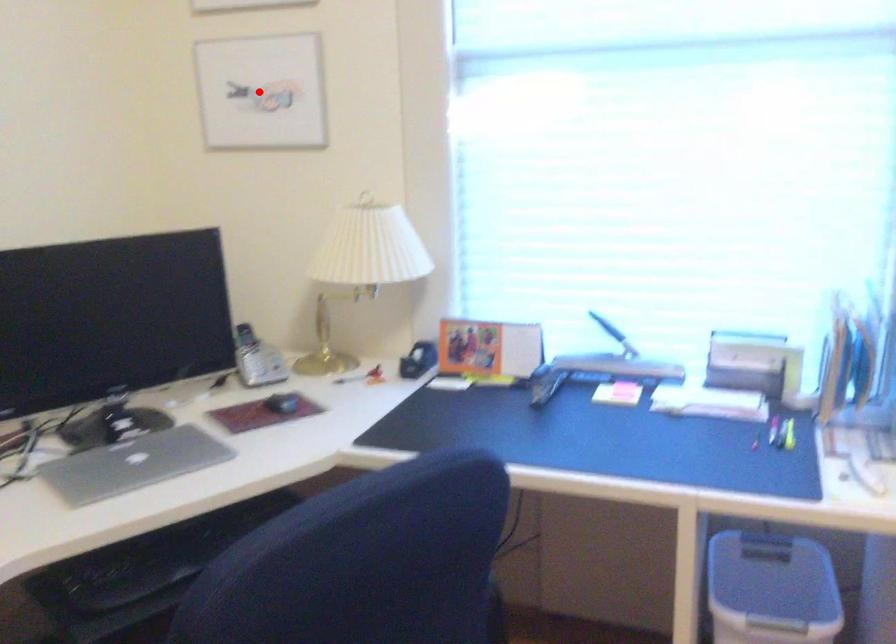
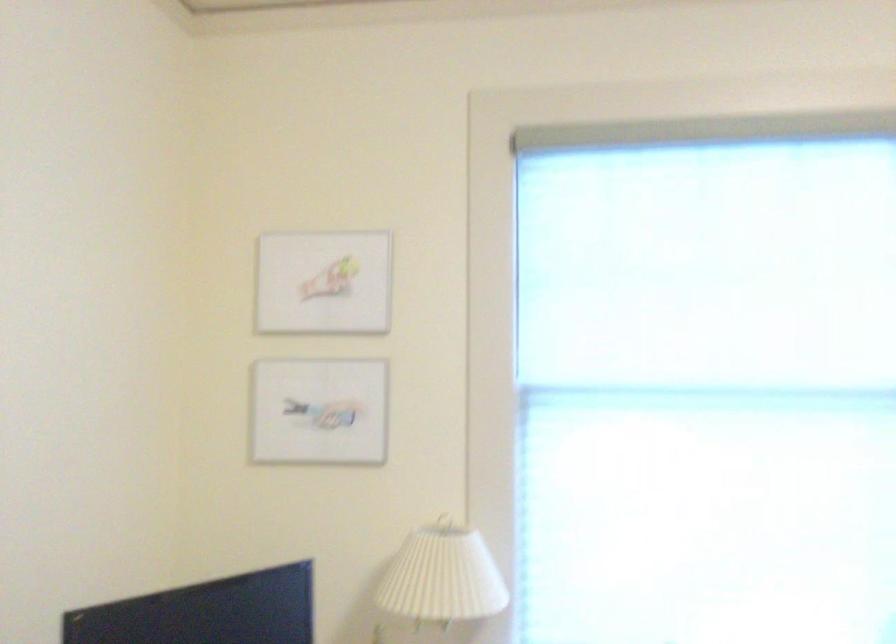
Locate, in the second image, the point that corresponds to the highlighted location in the first image.

(319, 412)